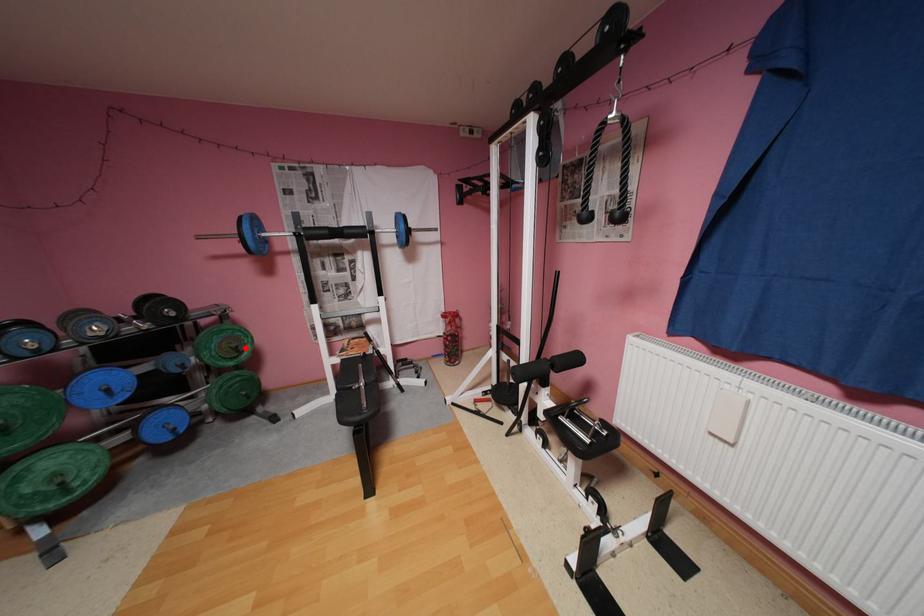
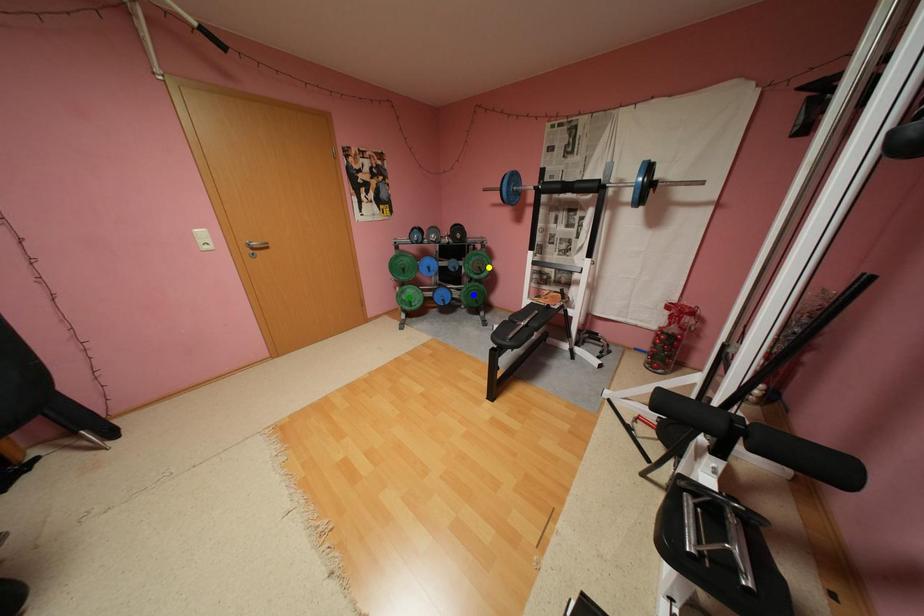
Question: I am providing you with two images of the same scene from different viewpoints. A red point is marked on the first image. You are given multiple points on the second image. Which point in image 2 is actually the same real-world point as the red point in image 1?

Choices:
 (A) blue point
 (B) green point
 (C) yellow point

Answer: (C)